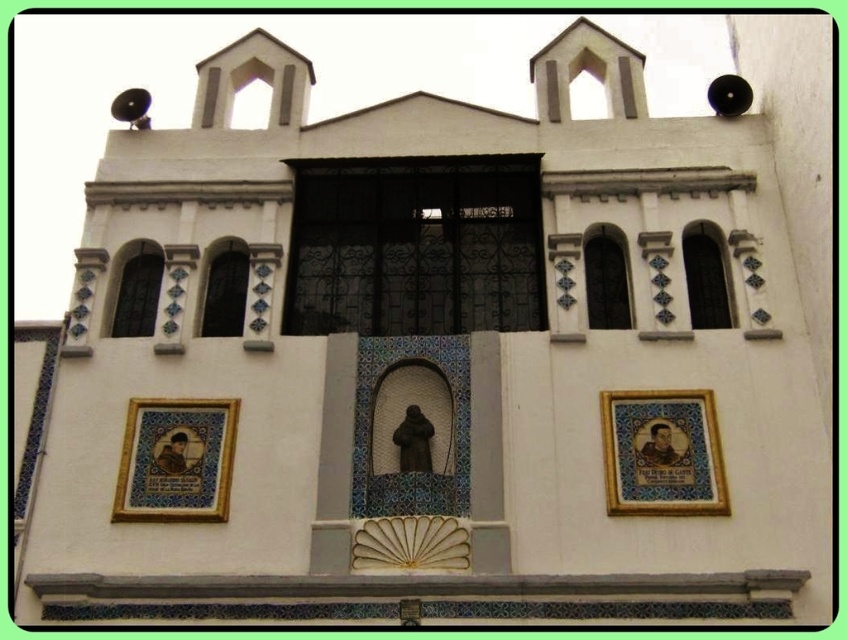
Is clear glass window at upper right thinner than matte glass window at center-right?

Incorrect, clear glass window at upper right's width is not less than matte glass window at center-right's.

Looking at this image, between clear glass window at upper right and matte glass window at center-right, which one is positioned lower?

matte glass window at center-right is lower down.

Is point (696, 304) positioned before point (599, 296)?

That is True.

The width and height of the screenshot is (847, 640). What are the coordinates of `clear glass window at upper right` in the screenshot? It's located at (707, 276).

Between clear glass window at upper right and matte glass window at upper left, which one has less height?

matte glass window at upper left is shorter.

Locate an element on the screen. This screenshot has height=640, width=847. clear glass window at upper right is located at coordinates (707, 276).

This screenshot has width=847, height=640. In order to click on clear glass window at upper right in this screenshot , I will do [x=707, y=276].

Is black wrought iron window at center shorter than clear glass window at upper right?

No, black wrought iron window at center is not shorter than clear glass window at upper right.

Describe the element at coordinates (414, 244) in the screenshot. I see `black wrought iron window at center` at that location.

Locate an element on the screen. The width and height of the screenshot is (847, 640). black wrought iron window at center is located at coordinates (414, 244).